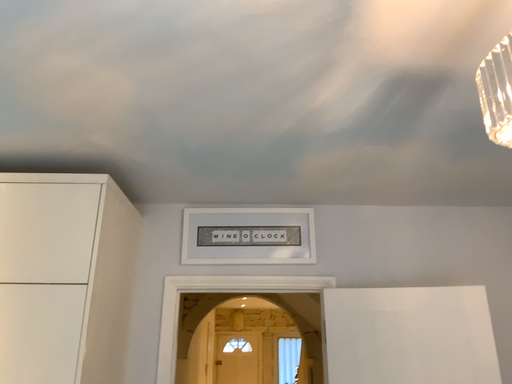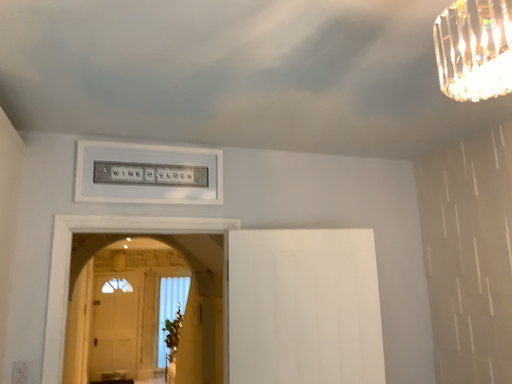
Question: Which way did the camera rotate in the video?

Choices:
 (A) rotated downward
 (B) rotated upward

Answer: (A)